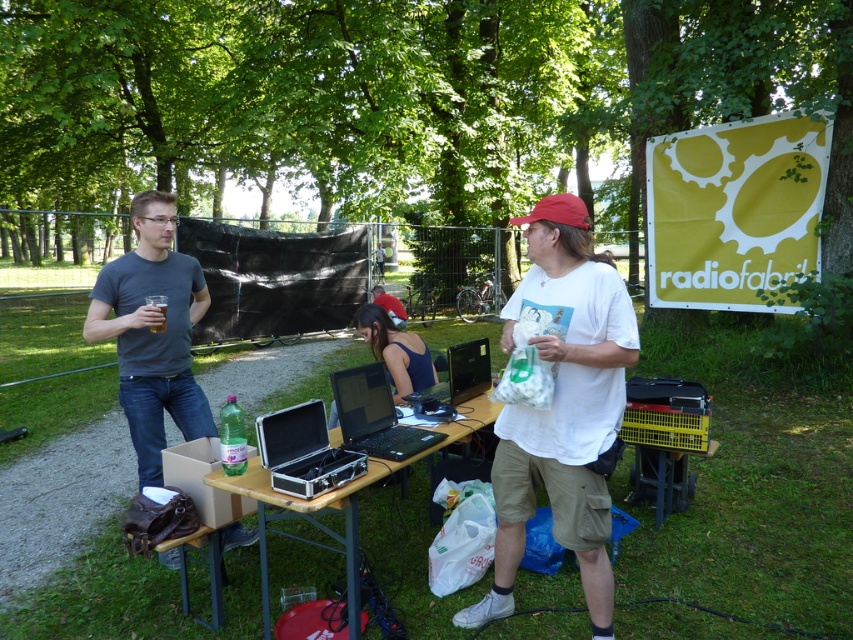
Question: Does black aluminum laptop at center appear over black plastic laptop at center?

Choices:
 (A) no
 (B) yes

Answer: (A)

Question: Among these points, which one is nearest to the camera?

Choices:
 (A) (567, 417)
 (B) (437, 385)
 (C) (357, 435)
 (D) (161, 192)

Answer: (A)

Question: Which object is positioned closest to the black aluminum laptop at center?

Choices:
 (A) wooden table at center
 (B) black plastic laptop at center

Answer: (B)

Question: Is white matte t-shirt at center positioned in front of wooden table at center?

Choices:
 (A) no
 (B) yes

Answer: (B)

Question: Is white matte t-shirt at center positioned in front of black aluminum laptop at center?

Choices:
 (A) yes
 (B) no

Answer: (A)

Question: Estimate the real-world distances between objects in this image. Which object is closer to the white matte t-shirt at center?

Choices:
 (A) matte black laptop at center
 (B) black glossy laptop at center
 (C) gray matte t-shirt at left
 (D) black plastic laptop at center

Answer: (D)